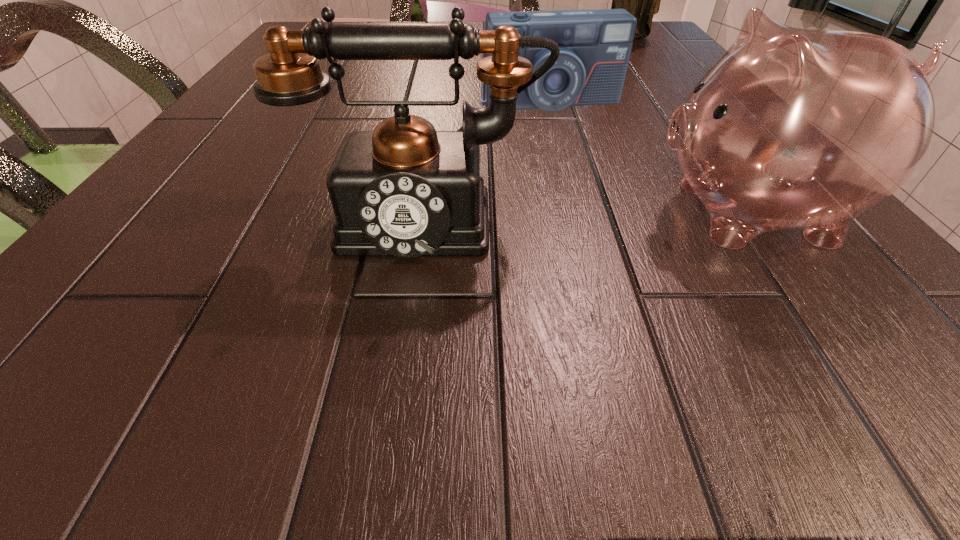
What are the coordinates of `free region located 0.380m on the lens of the shortest object` in the screenshot? It's located at (636, 266).

Locate an element on the screen. free space located 0.140m on the lens of the shortest object is located at coordinates (581, 157).

Locate an element on the screen. The width and height of the screenshot is (960, 540). vacant point located on the front-facing side of the tallest object is located at coordinates (616, 63).

Locate an element on the screen. The width and height of the screenshot is (960, 540). free location located 0.110m on the front-facing side of the tallest object is located at coordinates (617, 62).

Where is `vacant area situated on the front-facing side of the tallest object`? vacant area situated on the front-facing side of the tallest object is located at coordinates (594, 119).

Find the location of a particular element. object situated at the far edge is located at coordinates (642, 0).

The image size is (960, 540). What are the coordinates of `telephone at the near edge` in the screenshot? It's located at click(406, 190).

Where is `piggy bank at the near edge`? The image size is (960, 540). piggy bank at the near edge is located at coordinates (791, 128).

Locate an element on the screen. The width and height of the screenshot is (960, 540). piggy bank that is at the right edge is located at coordinates (791, 128).

Where is `figurine situated at the right edge`? The height and width of the screenshot is (540, 960). figurine situated at the right edge is located at coordinates (642, 0).